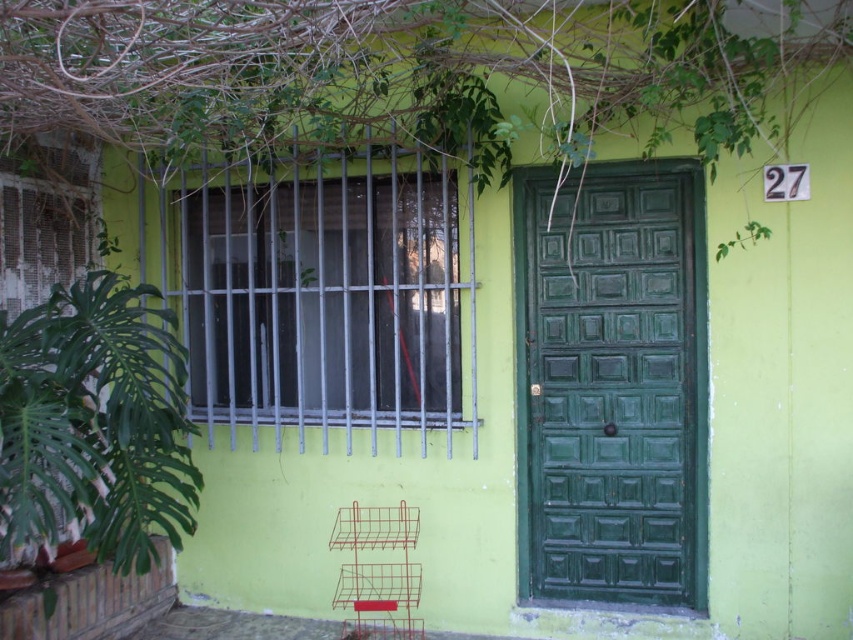
Question: Estimate the real-world distances between objects in this image. Which object is closer to the green wooden door at center?

Choices:
 (A) green leafy plant at upper center
 (B) green leafy plant at left
 (C) metallic bars at center

Answer: (C)

Question: Considering the relative positions of green leafy plant at upper center and metallic bars at center in the image provided, where is green leafy plant at upper center located with respect to metallic bars at center?

Choices:
 (A) right
 (B) left

Answer: (A)

Question: Observing the image, what is the correct spatial positioning of green wooden door at center in reference to green leafy plant at left?

Choices:
 (A) right
 (B) left

Answer: (A)

Question: Does green leafy plant at upper center have a smaller size compared to green wooden door at center?

Choices:
 (A) no
 (B) yes

Answer: (A)

Question: Among these points, which one is nearest to the camera?

Choices:
 (A) (68, 122)
 (B) (38, 340)
 (C) (695, 173)

Answer: (A)

Question: Which object is closer to the camera taking this photo?

Choices:
 (A) green wooden door at center
 (B) green leafy plant at upper center
 (C) metallic bars at center

Answer: (B)